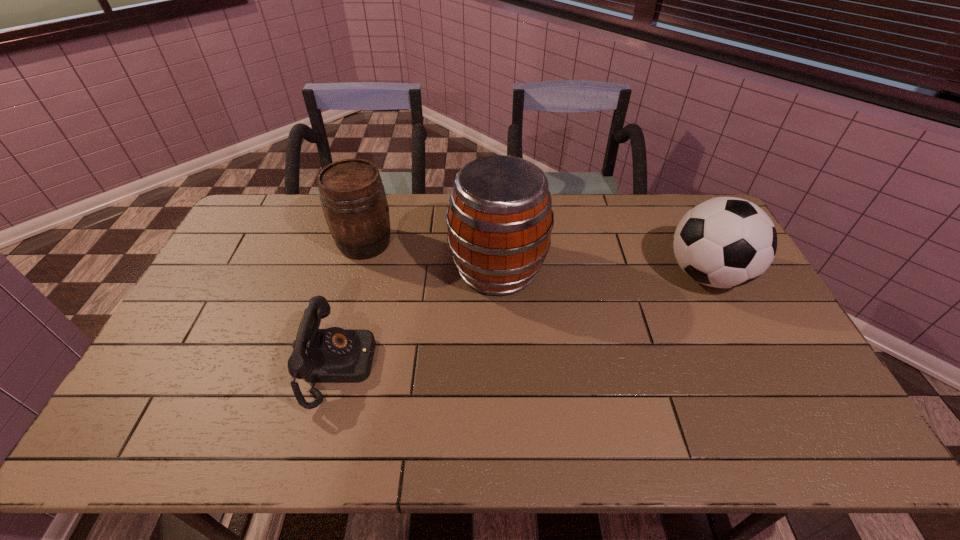
Find the location of a particular element. the second object from right to left is located at coordinates (499, 220).

In order to click on the taller cider in this screenshot , I will do `click(499, 220)`.

In order to click on the left cider in this screenshot , I will do `click(353, 199)`.

Identify the location of the rightmost object. (724, 242).

Locate an element on the screen. The height and width of the screenshot is (540, 960). telephone is located at coordinates (333, 355).

Where is `the shortest object`? the shortest object is located at coordinates (333, 355).

Identify the location of free space located on the front of the right cider. (500, 335).

This screenshot has height=540, width=960. In order to click on vacant space located on the side of the shorter cider near the bung hole in this screenshot , I will do `click(465, 243)`.

Image resolution: width=960 pixels, height=540 pixels. I want to click on vacant area situated 0.240m on the back of the rightmost object, so click(671, 204).

Find the location of a particular element. This screenshot has height=540, width=960. vacant space situated on the dial of the telephone is located at coordinates (429, 366).